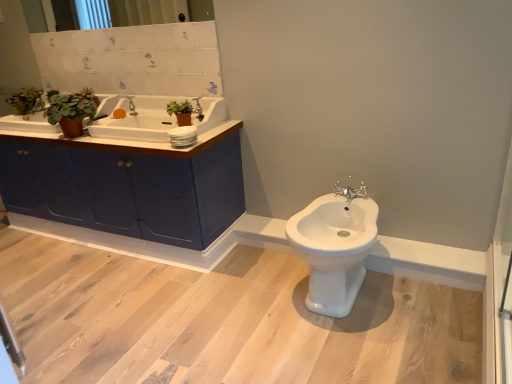
Question: Looking at the image, does clear glass mirror at upper center seem bigger or smaller compared to matte blue cabinet at left?

Choices:
 (A) small
 (B) big

Answer: (A)

Question: In the image, is clear glass mirror at upper center on the left side or the right side of matte blue cabinet at left?

Choices:
 (A) left
 (B) right

Answer: (B)

Question: Which of these objects is positioned farthest from the clear glass mirror at upper center?

Choices:
 (A) silver metallic tap at center, the first tap ordered from the bottom
 (B) white ceramic sink at upper left
 (C) green matte plant at upper left, arranged as the 2th plant when viewed from the right
 (D) matte blue cabinet at left
 (E) green matte plant at upper left, the 2th plant positioned from the left

Answer: (A)

Question: Estimate the real-world distances between objects in this image. Which object is farther from the silver metallic tap at upper center, acting as the first tap starting from the back?

Choices:
 (A) green matte plant at upper left, arranged as the 2th plant when viewed from the right
 (B) white glossy bidet at center
 (C) white ceramic sink at upper left
 (D) clear glass mirror at upper center
 (E) silver metallic tap at center, acting as the 2th tap starting from the top

Answer: (B)